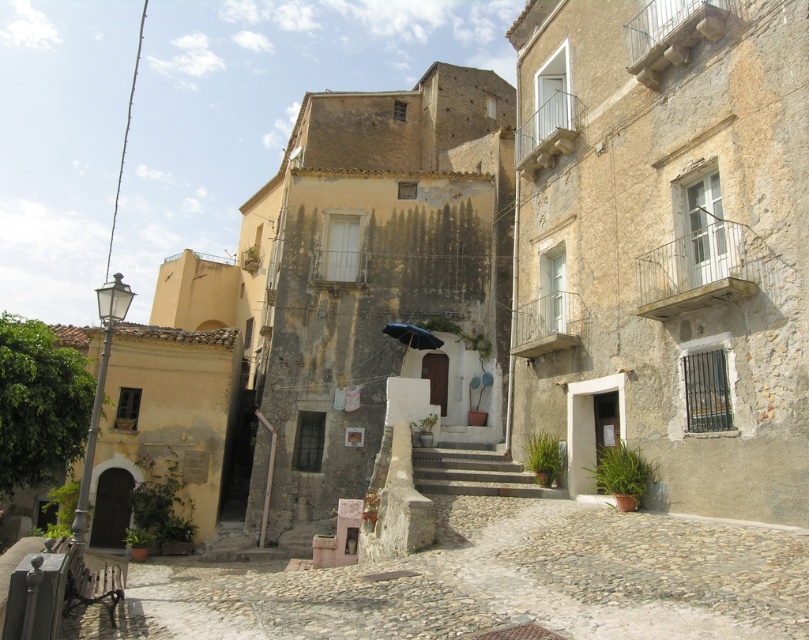
Question: Can you confirm if smooth stone stairs at center is positioned below black matte umbrella at center?

Choices:
 (A) yes
 (B) no

Answer: (A)

Question: Does smooth stone stairs at center have a larger size compared to black matte umbrella at center?

Choices:
 (A) yes
 (B) no

Answer: (A)

Question: Which of the following is the closest to the observer?

Choices:
 (A) (519, 484)
 (B) (435, 342)

Answer: (A)

Question: Observing the image, what is the correct spatial positioning of smooth stone stairs at center in reference to black matte umbrella at center?

Choices:
 (A) right
 (B) left

Answer: (A)